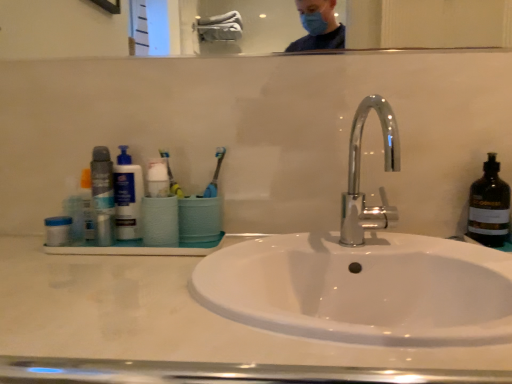
Question: In the image, is white glossy sink at center on the left side or the right side of matte black deodorant at left?

Choices:
 (A) left
 (B) right

Answer: (B)

Question: Considering the positions of white glossy sink at center and matte black deodorant at left in the image, is white glossy sink at center wider or thinner than matte black deodorant at left?

Choices:
 (A) thin
 (B) wide

Answer: (B)

Question: Which object is positioned farthest from the yellow rubber toothbrush at center?

Choices:
 (A) matte plastic bottle at left
 (B) white glossy sink at center
 (C) chrome/metallic faucet at center
 (D) blue plastic container at left
 (E) matte black deodorant at left

Answer: (C)

Question: Estimate the real-world distances between objects in this image. Which object is farther from the clear glass mirror at upper center?

Choices:
 (A) yellow rubber toothbrush at center
 (B) white glossy sink at center
 (C) matte black deodorant at left
 (D) chrome/metallic faucet at center
 (E) matte plastic bottle at left

Answer: (B)